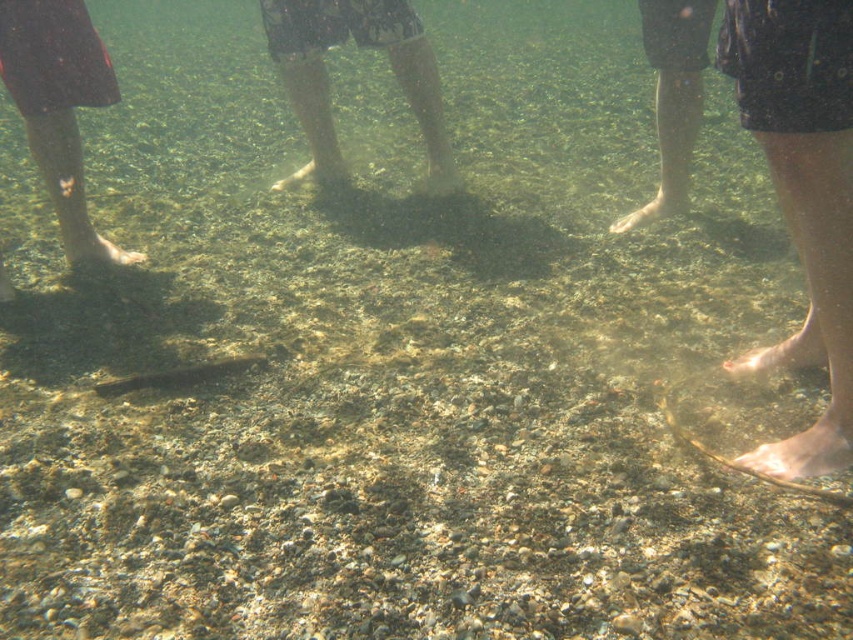
You are a snorkeler trying to locate your gear. You see the dark gray shorts at center and the matte skin foot at center. Which object is located to the right of the other?

The dark gray shorts at center is positioned on the right side of matte skin foot at center.